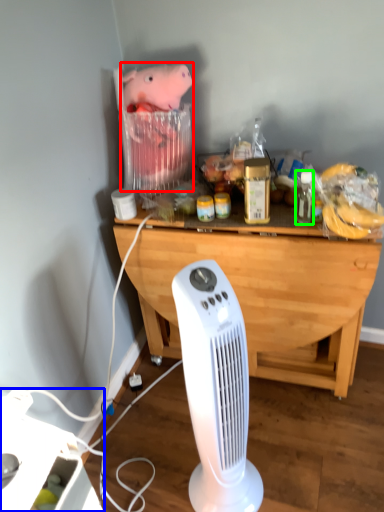
Question: Which object is positioned closest to animal (highlighted by a red box)? Select from appliance (highlighted by a blue box) and bottle (highlighted by a green box).

Choices:
 (A) appliance
 (B) bottle

Answer: (B)